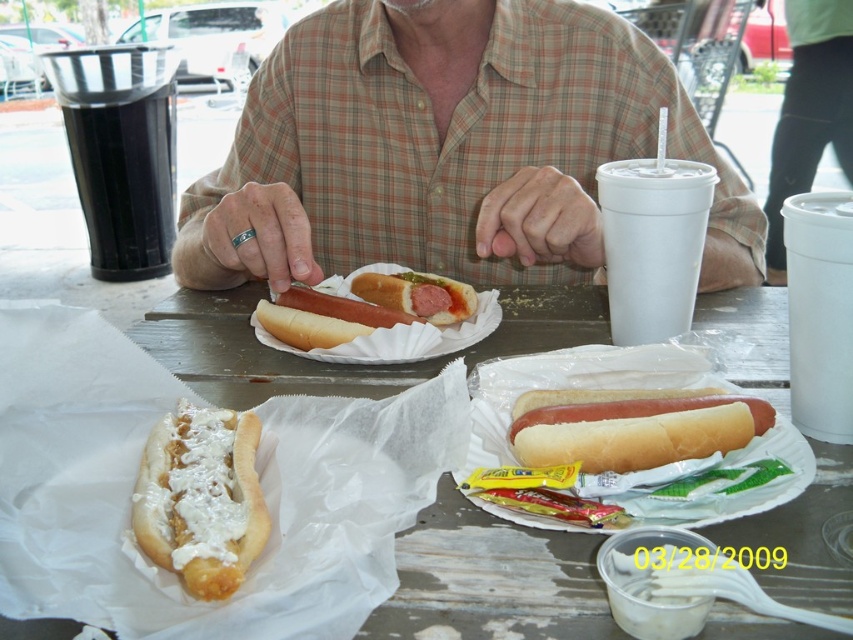
Question: Which object appears closest to the camera in this image?

Choices:
 (A) smooth red hot dog at center
 (B) white creamy hot dog at lower left
 (C) white paper hot dog at center
 (D) white bread hot dog at center

Answer: (C)

Question: Is white paper hot dog at center below matte white bun at center?

Choices:
 (A) yes
 (B) no

Answer: (A)

Question: Considering the relative positions of matte white bun at center and smooth red hot dog at center in the image provided, where is matte white bun at center located with respect to smooth red hot dog at center?

Choices:
 (A) right
 (B) left

Answer: (B)

Question: Does white paper hot dog at center come in front of matte white bun at center?

Choices:
 (A) yes
 (B) no

Answer: (A)

Question: Which point is closer to the camera?

Choices:
 (A) (204, 280)
 (B) (308, 316)
 (C) (463, 298)

Answer: (B)

Question: Which point is farther to the camera?

Choices:
 (A) white bread hot dog at center
 (B) plaid shirt at center
 (C) matte white bun at center

Answer: (B)